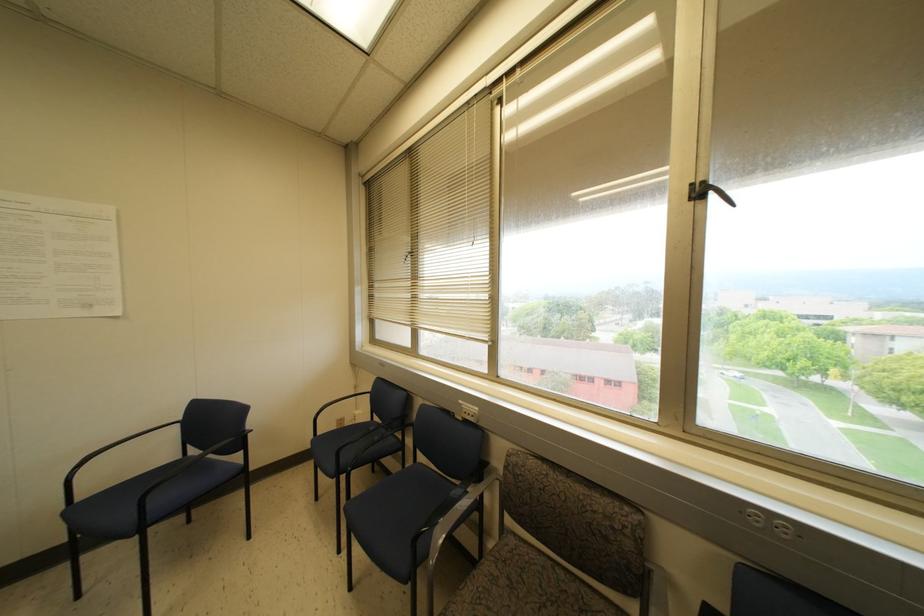
Image resolution: width=924 pixels, height=616 pixels. What do you see at coordinates (468, 180) in the screenshot?
I see `the blind pull cord` at bounding box center [468, 180].